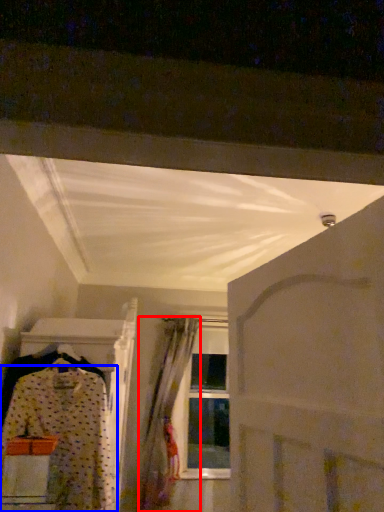
Question: Which object appears closest to the camera in this image, curtain (highlighted by a red box) or fancy dress (highlighted by a blue box)?

Choices:
 (A) curtain
 (B) fancy dress

Answer: (B)